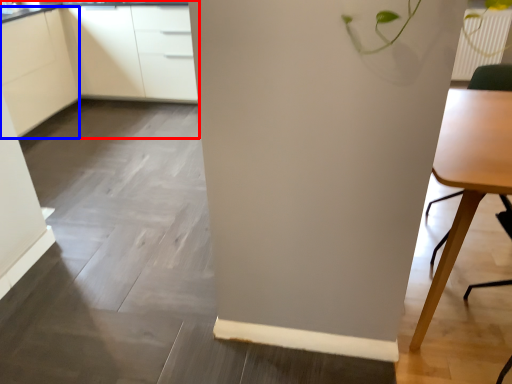
Question: Among these objects, which one is nearest to the camera, cabinetry (highlighted by a red box) or cabinetry (highlighted by a blue box)?

Choices:
 (A) cabinetry
 (B) cabinetry

Answer: (B)